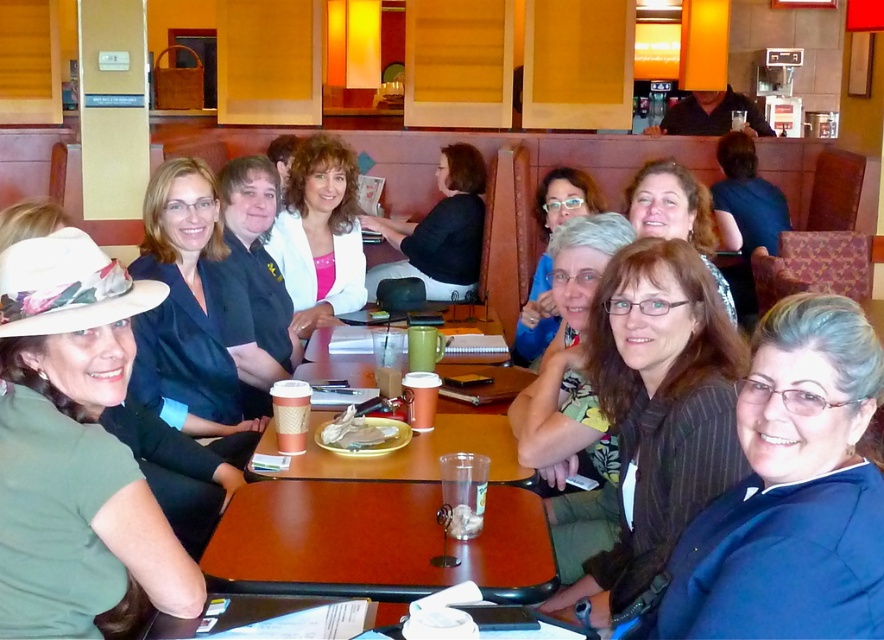
Question: Which of the following is the closest to the observer?

Choices:
 (A) black uniform at center
 (B) matte plastic cup at center
 (C) matte black shirt at center

Answer: (C)

Question: Is matte blue sweater at center to the right of clear plastic cup at table center from the viewer's perspective?

Choices:
 (A) yes
 (B) no

Answer: (A)

Question: Which object is the closest to the blue pinstripe blazer at lower right?

Choices:
 (A) pink satin blouse at center
 (B) matte black blazer at center

Answer: (B)

Question: Where is wooden table at center located in relation to black uniform at center in the image?

Choices:
 (A) below
 (B) above

Answer: (A)

Question: Estimate the real-world distances between objects in this image. Which object is farther from the black matte shirt at center?

Choices:
 (A) black uniform at center
 (B) matte black shirt at center
 (C) matte black blazer at center

Answer: (C)

Question: Is wooden table at center further to camera compared to matte blue sweater at center?

Choices:
 (A) no
 (B) yes

Answer: (A)